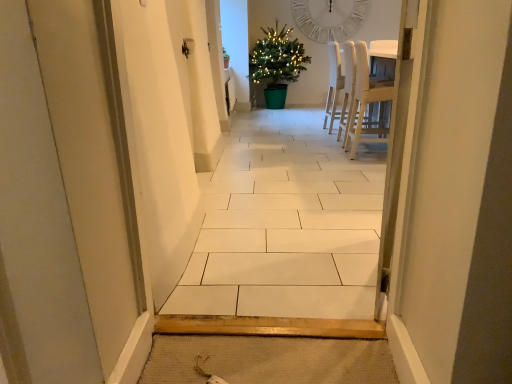
Identify the location of green plastic potted plant at center. (277, 64).

You are a GUI agent. You are given a task and a screenshot of the screen. Output one action in this format:
    pyautogui.click(x=<x>, y=<y>)
    Task: Click on the light wood chair at right, which appears as the first chair when viewed from the front
    
    Given the screenshot: What is the action you would take?
    pyautogui.click(x=367, y=104)

Describe the element at coordinates (367, 104) in the screenshot. I see `light wood chair at right, positioned as the second chair in back-to-front order` at that location.

Where is `white tile floor at center`? The image size is (512, 384). white tile floor at center is located at coordinates (286, 225).

Describe the element at coordinates (286, 225) in the screenshot. This screenshot has height=384, width=512. I see `white tile floor at center` at that location.

The width and height of the screenshot is (512, 384). I want to click on white matte clock at upper center, so click(x=329, y=18).

The width and height of the screenshot is (512, 384). In order to click on green plastic potted plant at center in this screenshot , I will do `click(277, 64)`.

Does green plastic potted plant at center have a larger size compared to white wood chair at center, which is the first chair from back to front?

Yes.

Is point (249, 73) farther from viewer compared to point (346, 135)?

Yes, point (249, 73) is farther from viewer.

Could you tell me if green plastic potted plant at center is turned towards white wood chair at center, which is counted as the second chair, starting from the front?

Yes, green plastic potted plant at center is turned towards white wood chair at center, which is counted as the second chair, starting from the front.

Can you confirm if green plastic potted plant at center is positioned to the left of white wood chair at center, which is the first chair from back to front?

Yes, green plastic potted plant at center is to the left of white wood chair at center, which is the first chair from back to front.

Considering the relative sizes of white tile floor at center and white matte clock at upper center in the image provided, is white tile floor at center shorter than white matte clock at upper center?

In fact, white tile floor at center may be taller than white matte clock at upper center.

What's the angular difference between white tile floor at center and white matte clock at upper center's facing directions?

The facing directions of white tile floor at center and white matte clock at upper center are 179 degrees apart.

From a real-world perspective, which object stands above the other?

white matte clock at upper center, from a real-world perspective.

In the image, is white tile floor at center positioned in front of or behind white matte clock at upper center?

Visually, white tile floor at center is located in front of white matte clock at upper center.

Can you tell me how much green plastic potted plant at center and white matte clock at upper center differ in facing direction?

The facing directions of green plastic potted plant at center and white matte clock at upper center are 1.63 degrees apart.

From the image's perspective, is green plastic potted plant at center above white matte clock at upper center?

No, from the image's perspective, green plastic potted plant at center is not above white matte clock at upper center.

Would you consider green plastic potted plant at center to be distant from white matte clock at upper center?

Actually, green plastic potted plant at center and white matte clock at upper center are a little close together.

Consider the image. Considering the relative sizes of green plastic potted plant at center and white matte clock at upper center in the image provided, is green plastic potted plant at center smaller than white matte clock at upper center?

No, green plastic potted plant at center is not smaller than white matte clock at upper center.

Is white matte clock at upper center inside or outside of white tile floor at center?

white matte clock at upper center is spatially situated outside white tile floor at center.

From a real-world perspective, does white matte clock at upper center sit lower than white tile floor at center?

Actually, white matte clock at upper center is physically above white tile floor at center in the real world.

What's the angular difference between white matte clock at upper center and white tile floor at center's facing directions?

white matte clock at upper center and white tile floor at center are facing 179 degrees away from each other.

Which is closer to the camera, (321, 33) or (284, 268)?

The point (284, 268) is in front.

In the scene shown: Is white matte clock at upper center in front of or behind white wood chair at center, which is the first chair from back to front, in the image?

Clearly, white matte clock at upper center is behind white wood chair at center, which is the first chair from back to front.

Is white wood chair at center, which is counted as the second chair, starting from the front, surrounded by white matte clock at upper center?

No, white wood chair at center, which is counted as the second chair, starting from the front, is not surrounded by white matte clock at upper center.

Which is nearer, (328,3) or (352,80)?

Point (328,3) is positioned farther from the camera compared to point (352,80).

Measure the distance from white matte clock at upper center to white wood chair at center, which is the first chair from back to front.

They are 2.28 meters apart.

Considering the sizes of objects white matte clock at upper center and green plastic potted plant at center in the image provided, who is bigger, white matte clock at upper center or green plastic potted plant at center?

green plastic potted plant at center.

Considering the relative positions of white matte clock at upper center and green plastic potted plant at center in the image provided, is white matte clock at upper center behind green plastic potted plant at center?

That is True.

Is white matte clock at upper center oriented towards green plastic potted plant at center?

No.

Consider the image. Considering the relative positions of white matte clock at upper center and green plastic potted plant at center in the image provided, is white matte clock at upper center to the right of green plastic potted plant at center from the viewer's perspective?

Yes.

Are white wood chair at center, which is counted as the second chair, starting from the front, and green plastic potted plant at center making contact?

No, white wood chair at center, which is counted as the second chair, starting from the front, is not beside green plastic potted plant at center.

Is the depth of white wood chair at center, which is counted as the second chair, starting from the front, greater than that of green plastic potted plant at center?

No.

Considering the relative sizes of white wood chair at center, which is the first chair from back to front, and green plastic potted plant at center in the image provided, is white wood chair at center, which is the first chair from back to front, taller than green plastic potted plant at center?

In fact, white wood chair at center, which is the first chair from back to front, may be shorter than green plastic potted plant at center.

Where is `houseplant above the white wood chair at center, which is counted as the second chair, starting from the front (from a real-world perspective)`? The image size is (512, 384). houseplant above the white wood chair at center, which is counted as the second chair, starting from the front (from a real-world perspective) is located at coordinates (277, 64).

Image resolution: width=512 pixels, height=384 pixels. I want to click on clock lying behind the white tile floor at center, so click(329, 18).

Looking at the image, which one is located closer to light wood chair at right, which appears as the first chair when viewed from the front, green plastic potted plant at center or white wood chair at center, which is counted as the second chair, starting from the front?

white wood chair at center, which is counted as the second chair, starting from the front, lies closer to light wood chair at right, which appears as the first chair when viewed from the front, than the other object.

Based on their spatial positions, is green plastic potted plant at center or white tile floor at center closer to light wood chair at right, positioned as the second chair in back-to-front order?

white tile floor at center lies closer to light wood chair at right, positioned as the second chair in back-to-front order, than the other object.

Looking at the image, which one is located further to white tile floor at center, green plastic potted plant at center or white matte clock at upper center?

The object further to white tile floor at center is white matte clock at upper center.

Considering their positions, is white matte clock at upper center positioned closer to white tile floor at center than green plastic potted plant at center?

green plastic potted plant at center.

From the image, which object appears to be farther from white matte clock at upper center, white wood chair at center, which is counted as the second chair, starting from the front, or green plastic potted plant at center?

white wood chair at center, which is counted as the second chair, starting from the front, is further to white matte clock at upper center.

Based on the photo, considering their positions, is white matte clock at upper center positioned closer to white tile floor at center than white wood chair at center, which is counted as the second chair, starting from the front?

The object closer to white tile floor at center is white wood chair at center, which is counted as the second chair, starting from the front.

From the image, which object appears to be farther from green plastic potted plant at center, light wood chair at right, which appears as the first chair when viewed from the front, or white tile floor at center?

The object further to green plastic potted plant at center is white tile floor at center.

Which object lies further to the anchor point white matte clock at upper center, light wood chair at right, positioned as the second chair in back-to-front order, or green plastic potted plant at center?

Based on the image, light wood chair at right, positioned as the second chair in back-to-front order, appears to be further to white matte clock at upper center.

Where is `chair between white tile floor at center and white wood chair at center, which is the first chair from back to front, in the front-back direction`? The height and width of the screenshot is (384, 512). chair between white tile floor at center and white wood chair at center, which is the first chair from back to front, in the front-back direction is located at coordinates (367, 104).

Image resolution: width=512 pixels, height=384 pixels. I want to click on houseplant between white tile floor at center and white matte clock at upper center from front to back, so 277,64.

Locate an element on the screen. Image resolution: width=512 pixels, height=384 pixels. houseplant located between light wood chair at right, which appears as the first chair when viewed from the front, and white matte clock at upper center in the depth direction is located at coordinates (277, 64).

At what (x,y) coordinates should I click in order to perform the action: click on houseplant between white wood chair at center, which is counted as the second chair, starting from the front, and white matte clock at upper center in the front-back direction. Please return your answer as a coordinate pair (x, y). The width and height of the screenshot is (512, 384). Looking at the image, I should click on (277, 64).